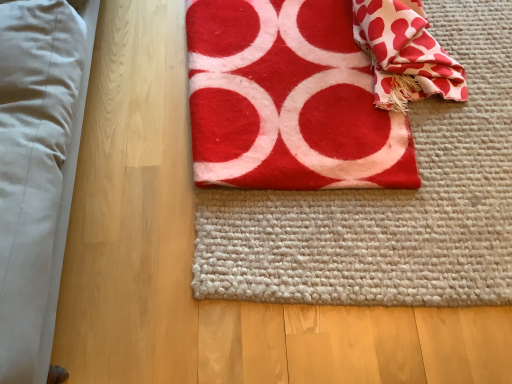
Question: Looking at their shapes, would you say red felt towel at center is wider or thinner than white textured fabric at upper right?

Choices:
 (A) thin
 (B) wide

Answer: (B)

Question: Does point (280, 67) appear closer or farther from the camera than point (397, 64)?

Choices:
 (A) closer
 (B) farther

Answer: (B)

Question: Which object is the closest to the white textured fabric at upper right?

Choices:
 (A) red felt yoga mat at center
 (B) red felt towel at center

Answer: (B)

Question: Considering the real-world distances, which object is farthest from the red felt towel at center?

Choices:
 (A) white textured fabric at upper right
 (B) red felt yoga mat at center

Answer: (A)